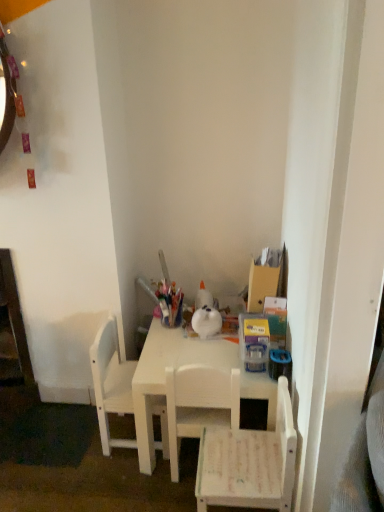
Question: In terms of width, does white matte table at center look wider or thinner when compared to white matte chair at center, which ranks as the 2th chair in right-to-left order?

Choices:
 (A) thin
 (B) wide

Answer: (B)

Question: From a real-world perspective, is white matte table at center above or below white matte chair at center, marked as the 2th chair in a left-to-right arrangement?

Choices:
 (A) below
 (B) above

Answer: (A)

Question: Which object is positioned closest to the white matte chair at center, marked as the 2th chair in a left-to-right arrangement?

Choices:
 (A) white matte chair at left, the first chair positioned from the left
 (B) white matte chair at lower right, which appears as the first chair when viewed from the right
 (C) white matte table at center

Answer: (C)

Question: Which of these objects is positioned farthest from the white matte chair at lower right, which ranks as the third chair in left-to-right order?

Choices:
 (A) white matte table at center
 (B) white matte chair at left, which ranks as the 3th chair in right-to-left order
 (C) white matte chair at center, marked as the 2th chair in a left-to-right arrangement

Answer: (B)